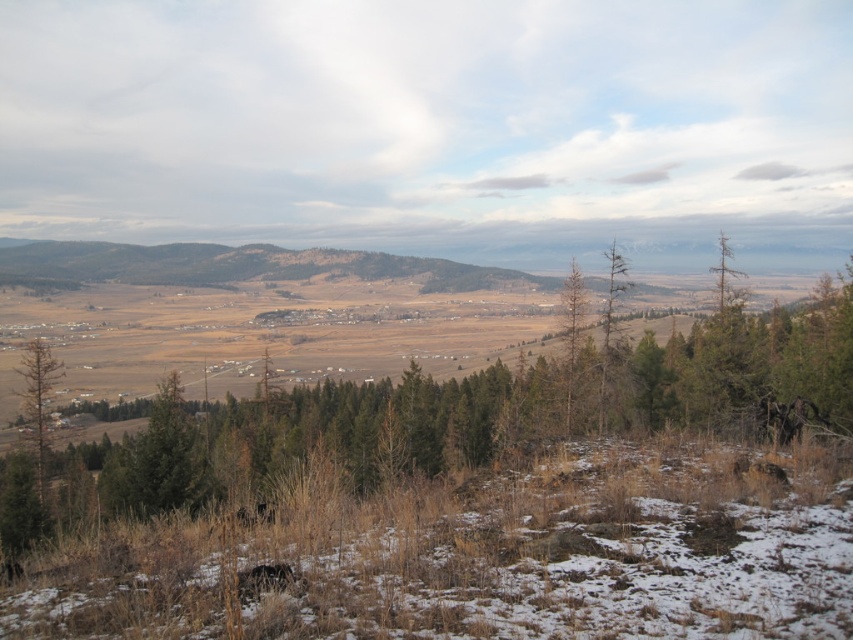
Looking at this image, is green matte tree at center bigger than green matte tree at left?

Yes, green matte tree at center is bigger than green matte tree at left.

Identify the location of green matte tree at center. This screenshot has height=640, width=853. (x=457, y=417).

Measure the distance between green matte tree at center and camera.

green matte tree at center and camera are 32.09 feet apart.

At what (x,y) coordinates should I click in order to perform the action: click on green matte tree at center. Please return your answer as a coordinate pair (x, y). Image resolution: width=853 pixels, height=640 pixels. Looking at the image, I should click on (457, 417).